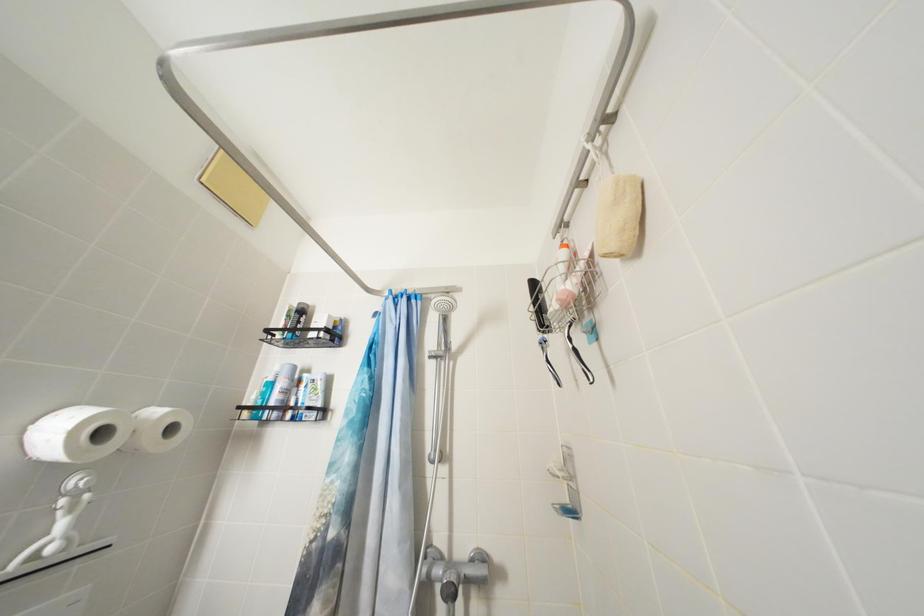
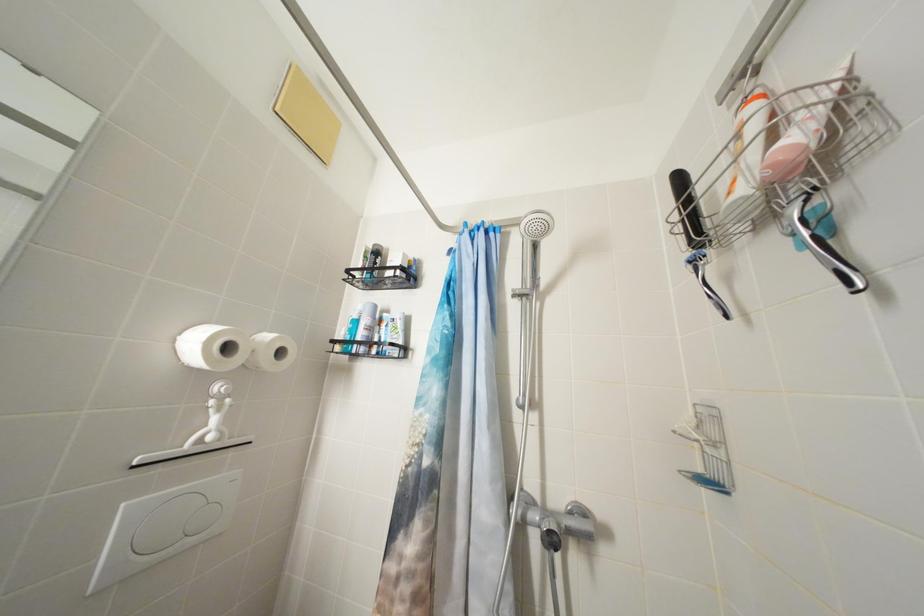
What movement of the cameraman would produce the second image?

The movement direction of the cameraman is left, forward.